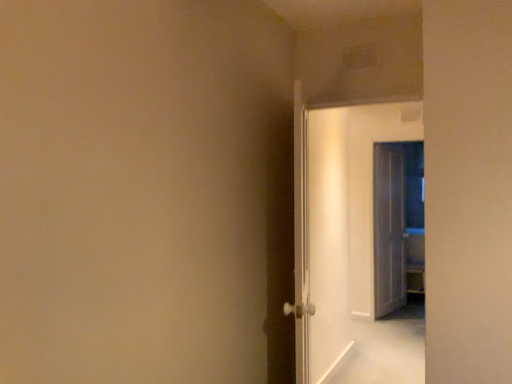
Question: Is white glossy door at center, which is the 2th door from right to left, surrounded by white glossy door at center, placed as the first door when sorted from front to back?

Choices:
 (A) yes
 (B) no

Answer: (B)

Question: Considering the relative positions of white glossy door at center, which is counted as the 1th door, starting from the left, and white glossy door at center, which appears as the second door when viewed from the back, in the image provided, is white glossy door at center, which is counted as the 1th door, starting from the left, to the right of white glossy door at center, which appears as the second door when viewed from the back, from the viewer's perspective?

Choices:
 (A) yes
 (B) no

Answer: (B)

Question: Could you tell me if white glossy door at center, the third door viewed from the right, is facing white glossy door at center, which appears as the second door when viewed from the back?

Choices:
 (A) yes
 (B) no

Answer: (A)

Question: From a real-world perspective, is white glossy door at center, which is counted as the 1th door, starting from the left, located higher than white glossy door at center, acting as the 2th door starting from the left?

Choices:
 (A) yes
 (B) no

Answer: (B)

Question: Does white glossy door at center, the third door viewed from the right, touch white glossy door at center, acting as the 2th door starting from the left?

Choices:
 (A) yes
 (B) no

Answer: (B)

Question: Does point (379, 304) appear closer or farther from the camera than point (304, 329)?

Choices:
 (A) farther
 (B) closer

Answer: (A)

Question: Is translucent glass door at right, the 1th door from the back, to the left or to the right of white glossy door at center, which is the third door from back to front, in the image?

Choices:
 (A) right
 (B) left

Answer: (A)

Question: In terms of size, does translucent glass door at right, the 3th door positioned from the front, appear bigger or smaller than white glossy door at center, which is counted as the 1th door, starting from the left?

Choices:
 (A) small
 (B) big

Answer: (A)

Question: In terms of height, does translucent glass door at right, the 3th door positioned from the front, look taller or shorter compared to white glossy door at center, which is counted as the 1th door, starting from the left?

Choices:
 (A) short
 (B) tall

Answer: (B)

Question: Considering the positions of white glossy door at center, which is the third door from back to front, and white glossy door at center, which appears as the second door when viewed from the back, in the image, is white glossy door at center, which is the third door from back to front, wider or thinner than white glossy door at center, which appears as the second door when viewed from the back,?

Choices:
 (A) thin
 (B) wide

Answer: (B)

Question: Based on their positions, is white glossy door at center, placed as the first door when sorted from front to back, located to the left or right of white glossy door at center, acting as the second door starting from the front?

Choices:
 (A) left
 (B) right

Answer: (A)

Question: From the image's perspective, is white glossy door at center, which is counted as the 1th door, starting from the left, positioned above or below white glossy door at center, acting as the 2th door starting from the left?

Choices:
 (A) above
 (B) below

Answer: (B)

Question: Relative to white glossy door at center, acting as the second door starting from the front, is white glossy door at center, which is counted as the 1th door, starting from the left, in front or behind?

Choices:
 (A) front
 (B) behind

Answer: (A)

Question: Would you say white glossy door at center, which is counted as the 1th door, starting from the left, is inside or outside translucent glass door at right, the first door when ordered from right to left?

Choices:
 (A) outside
 (B) inside

Answer: (A)

Question: In the image, is white glossy door at center, the third door viewed from the right, on the left side or the right side of translucent glass door at right, the first door when ordered from right to left?

Choices:
 (A) right
 (B) left

Answer: (B)